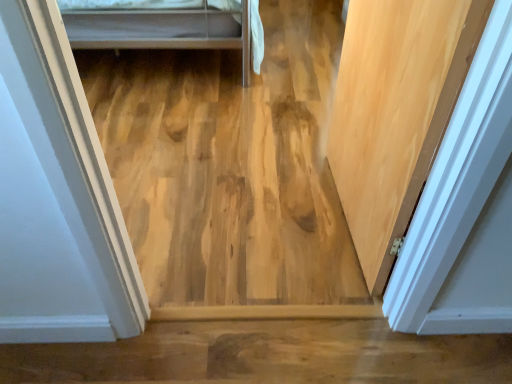
Measure the distance between point (360, 136) and camera.

The depth of point (360, 136) is 1.40 meters.

Locate an element on the screen. This screenshot has height=384, width=512. natural wood door at right is located at coordinates (395, 112).

Describe the element at coordinates (395, 112) in the screenshot. I see `natural wood door at right` at that location.

In order to face natural wood plywood at center, should I rotate leftwards or rightwards?

To align with it, rotate left about 4.207°.

What do you see at coordinates (226, 173) in the screenshot? I see `natural wood plywood at center` at bounding box center [226, 173].

Where is `natural wood plywood at center`? Image resolution: width=512 pixels, height=384 pixels. natural wood plywood at center is located at coordinates (226, 173).

Identify the location of natural wood door at right. The image size is (512, 384). (395, 112).

Considering the positions of objects natural wood door at right and natural wood plywood at center in the image provided, who is more to the left, natural wood door at right or natural wood plywood at center?

Positioned to the left is natural wood plywood at center.

Which object is further away from the camera taking this photo, natural wood door at right or natural wood plywood at center?

natural wood plywood at center is more distant.

Is point (406, 185) more distant than point (137, 213)?

No, (406, 185) is closer to viewer.

From the image's perspective, is natural wood door at right above or below natural wood plywood at center?

Clearly, from the image's perspective, natural wood door at right is below natural wood plywood at center.

From a real-world perspective, between natural wood door at right and natural wood plywood at center, who is vertically lower?

natural wood plywood at center.

In terms of width, does natural wood door at right look wider or thinner when compared to natural wood plywood at center?

In the image, natural wood door at right appears to be more narrow than natural wood plywood at center.

Does natural wood door at right have a greater height compared to natural wood plywood at center?

Yes, natural wood door at right is taller than natural wood plywood at center.

Who is bigger, natural wood door at right or natural wood plywood at center?

natural wood plywood at center.

Is natural wood door at right spatially inside natural wood plywood at center, or outside of it?

natural wood door at right is not inside natural wood plywood at center, it's outside.

Is there a large distance between natural wood door at right and natural wood plywood at center?

No, there isn't a large distance between natural wood door at right and natural wood plywood at center.

Does natural wood door at right turn towards natural wood plywood at center?

No, natural wood door at right is not oriented towards natural wood plywood at center.

How much distance is there between natural wood door at right and natural wood plywood at center?

natural wood door at right and natural wood plywood at center are 27.74 inches apart.

In order to click on plywood that appears behind the natural wood door at right in this screenshot , I will do `click(226, 173)`.

Does natural wood plywood at center appear on the right side of natural wood door at right?

Incorrect, natural wood plywood at center is not on the right side of natural wood door at right.

Which object is further away from the camera, natural wood plywood at center or natural wood door at right?

natural wood plywood at center is further from the camera.

Looking at this image, which is closer, (164,193) or (404,163)?

Point (404,163)

From the image's perspective, who appears lower, natural wood plywood at center or natural wood door at right?

natural wood door at right appears lower in the image.

From a real-world perspective, is natural wood plywood at center above or below natural wood door at right?

natural wood plywood at center is below natural wood door at right.

Is natural wood plywood at center thinner than natural wood door at right?

No, natural wood plywood at center is not thinner than natural wood door at right.

Does natural wood plywood at center have a greater height compared to natural wood door at right?

Incorrect, the height of natural wood plywood at center is not larger of that of natural wood door at right.

Is natural wood plywood at center bigger than natural wood door at right?

Yes.

Does natural wood plywood at center contain natural wood door at right?

Actually, natural wood door at right is outside natural wood plywood at center.

Looking at this image, are natural wood plywood at center and natural wood door at right located far from each other?

No, natural wood plywood at center is not far from natural wood door at right.

From the picture: Could you tell me if natural wood plywood at center is turned towards natural wood door at right?

No.

Looking at this image, how many degrees apart are the facing directions of natural wood plywood at center and natural wood door at right?

There is a 88.2-degree angle between the facing directions of natural wood plywood at center and natural wood door at right.

Measure the distance between natural wood plywood at center and natural wood door at right.

The distance of natural wood plywood at center from natural wood door at right is 27.74 inches.

Image resolution: width=512 pixels, height=384 pixels. What are the coordinates of `door that is in front of the natural wood plywood at center` in the screenshot? It's located at (395, 112).

The width and height of the screenshot is (512, 384). I want to click on plywood that is behind the natural wood door at right, so click(x=226, y=173).

The width and height of the screenshot is (512, 384). I want to click on plywood below the natural wood door at right (from a real-world perspective), so click(226, 173).